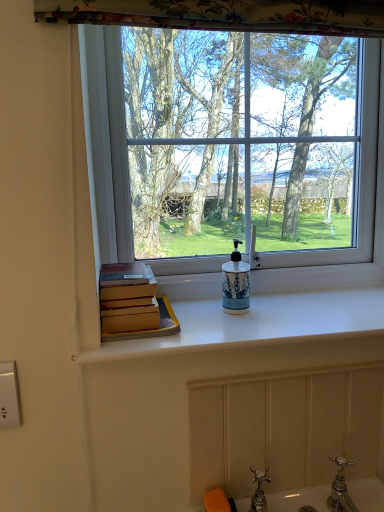
Find the location of a particular element. The image size is (384, 512). vacant area that lies in front of blue and white ceramic soap dispenser at center is located at coordinates (235, 330).